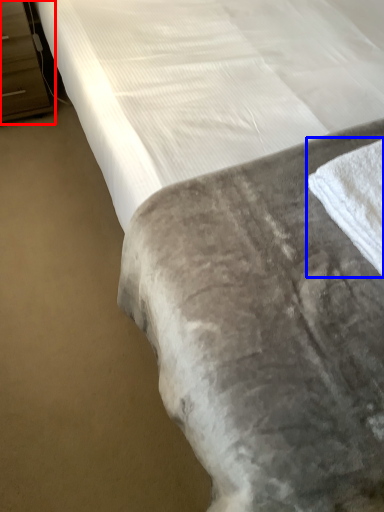
Question: Which object is closer to the camera taking this photo, dresser (highlighted by a red box) or bath towel (highlighted by a blue box)?

Choices:
 (A) dresser
 (B) bath towel

Answer: (B)